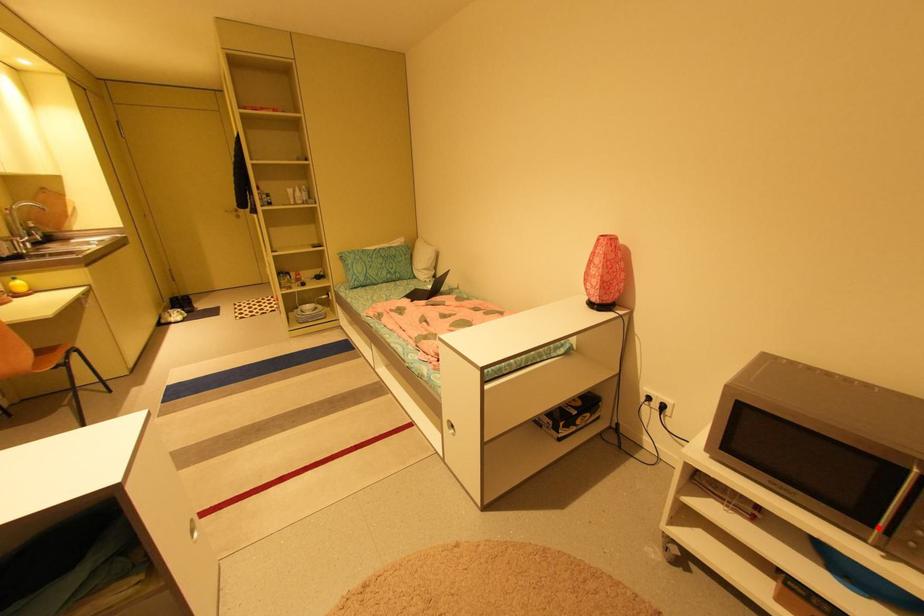
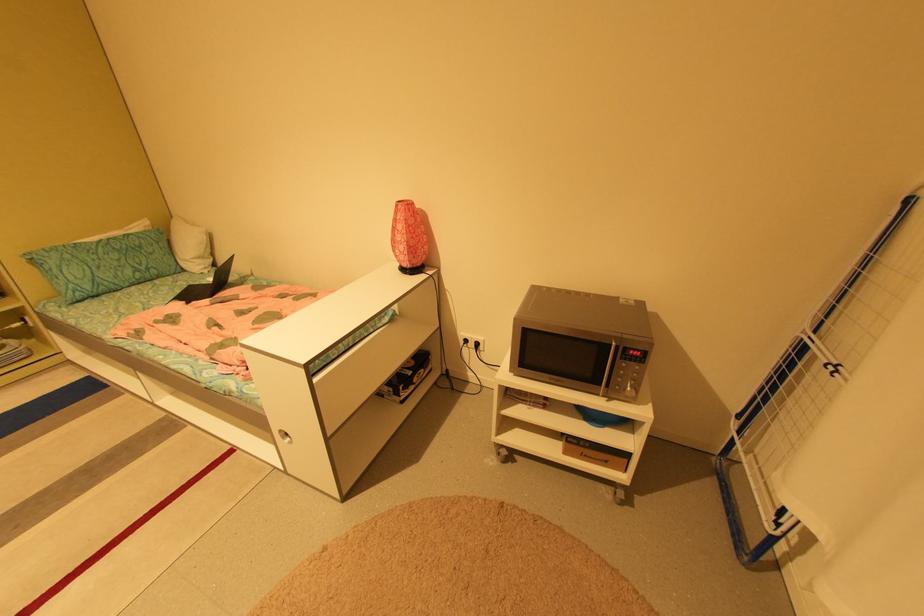
Question: I am providing you with two images of the same scene from different viewpoints. In image1, a red point is highlighted. Considering the same 3D point in image2, which of the following is correct?

Choices:
 (A) It is closer
 (B) It is farther

Answer: (B)